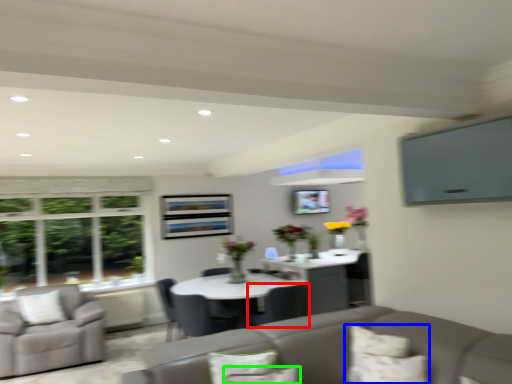
Question: Which object is positioned farthest from chair (highlighted by a red box)? Select from pillow (highlighted by a blue box) and pillow (highlighted by a green box).

Choices:
 (A) pillow
 (B) pillow

Answer: (B)